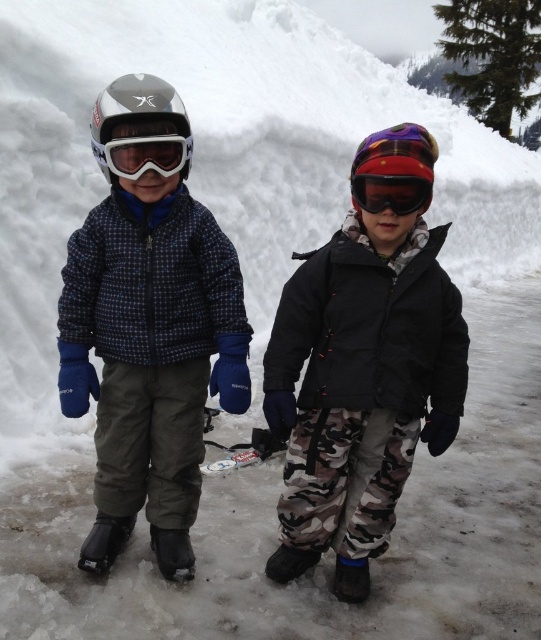
You are a photographer trying to capture the matte black goggles at left in the image. Based on the coordinates provided, where should you focus your camera? Please specify the coordinates in the format of a point like point. (143, 154).

The coordinates point. (143, 154) correspond to the matte black goggles at left, so you should focus your camera there.